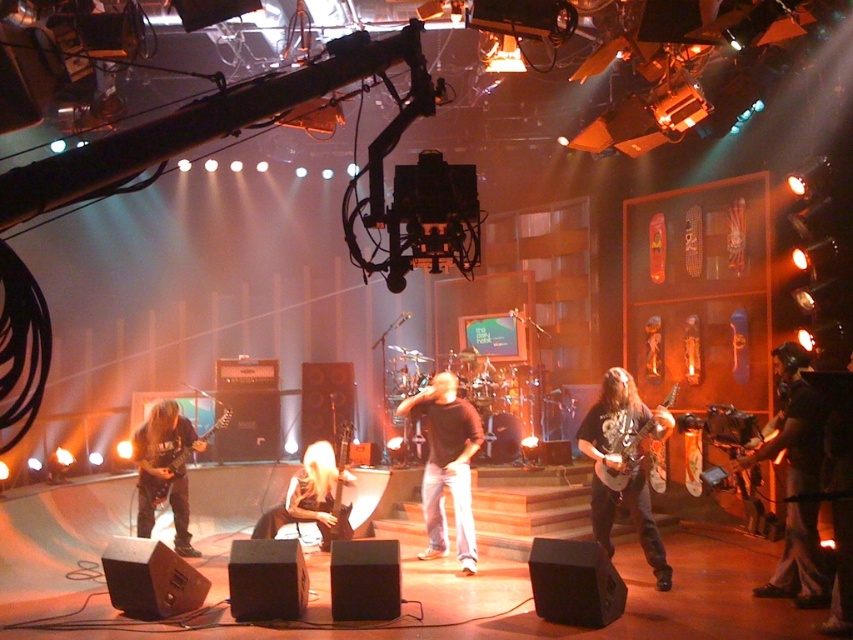
You are a stagehand who needs to place a new spotlight on the stage. The spotlight has a beam width of 1 meter. You want to ensure it can cover both the black leather jacket at center and the shiny metallic guitar at center right simultaneously. Based on their positions and sizes, do you think the spotlight can cover both objects without moving it?

The black leather jacket at center might be wider than the shiny metallic guitar at center right. Since the spotlight has a beam width of 1 meter, if the distance between the two objects is within that width, it could potentially cover both. However, without exact measurements of their separation and the jacket and guitar widths, it is uncertain. The description only provides a comparative width between the two objects, not their exact positions or distances apart.

You are a stagehand who needs to move a 3 meter long equipment from the shiny black guitar at center to the metallic silver guitar at center. Can you fit it between them without bending it?

The distance between the shiny black guitar at center and the metallic silver guitar at center is 2.51 meters. Since the equipment is 3 meters long, it cannot be placed straight between them without bending.